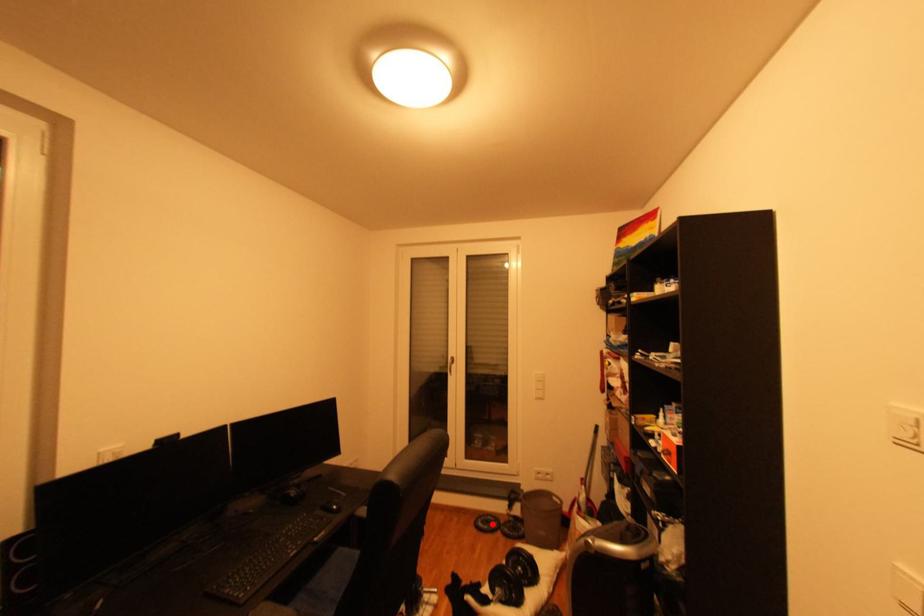
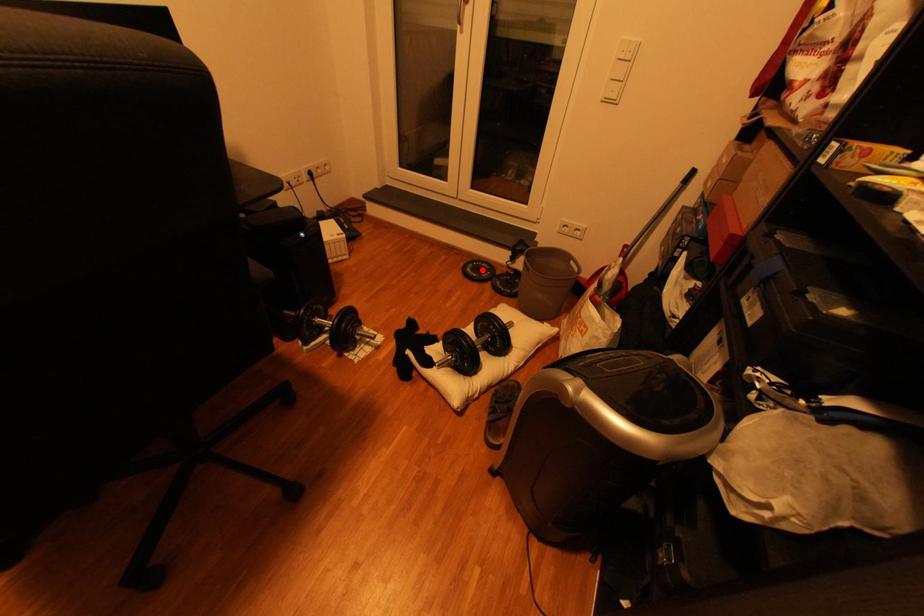
I am providing you with two images of the same scene from different viewpoints. A red point is marked on the first image and another point is marked on the second image. Is the red point in image1 aligned with the point shown in image2?

Yes